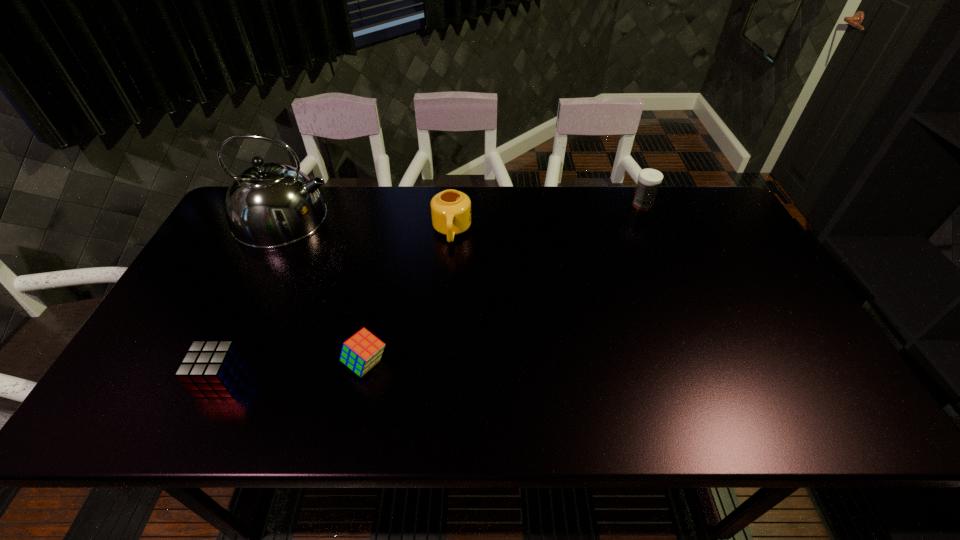
Where is `vacant area that lies between the left cube and the kettle`? vacant area that lies between the left cube and the kettle is located at coordinates (253, 299).

You are a GUI agent. You are given a task and a screenshot of the screen. Output one action in this format:
    pyautogui.click(x=<x>, y=<y>)
    Task: Click on the free space that is in between the mug and the rightmost object
    The image size is (960, 540).
    Given the screenshot: What is the action you would take?
    pyautogui.click(x=547, y=218)

Where is `vacant point located between the tallest object and the third object from right to left`? vacant point located between the tallest object and the third object from right to left is located at coordinates (325, 291).

Identify the location of vacant area that lies between the left cube and the second object from right to left. Image resolution: width=960 pixels, height=540 pixels. (337, 306).

Identify the location of vacant point located between the third object from right to left and the tallest object. This screenshot has width=960, height=540. (325, 291).

Identify the location of free spot between the left cube and the second object from right to left. (337, 306).

Find the location of a particular element. free area in between the right cube and the mug is located at coordinates (409, 298).

Where is `free space between the right cube and the kettle`? The height and width of the screenshot is (540, 960). free space between the right cube and the kettle is located at coordinates pos(325,291).

Where is `object that stands as the third closest to the left cube`? object that stands as the third closest to the left cube is located at coordinates (451, 210).

This screenshot has width=960, height=540. I want to click on object that ranks as the third closest to the fourth object from left to right, so click(649, 179).